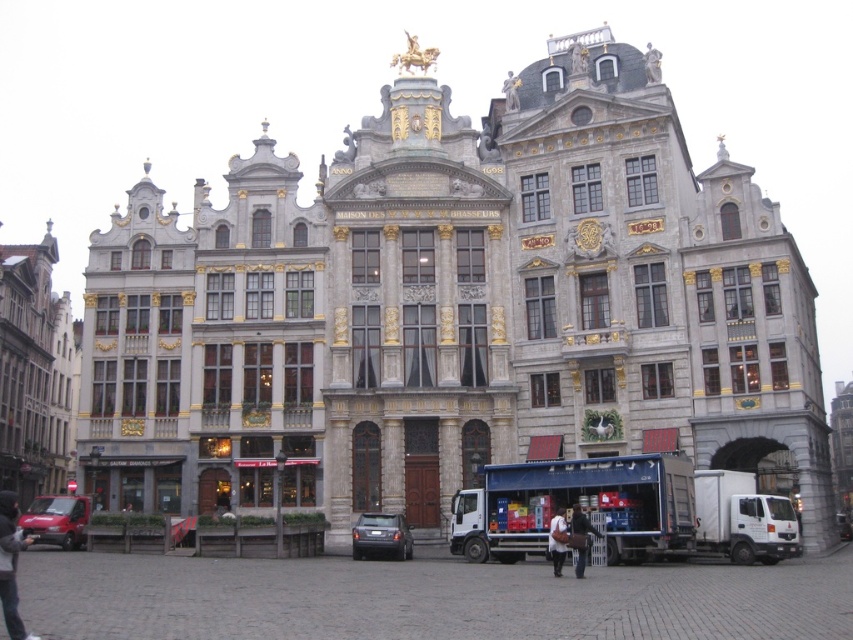
Question: Where is matte red van at lower left located in relation to dark gray shirt at center in the image?

Choices:
 (A) above
 (B) below

Answer: (B)

Question: Is dark brown leather jacket at lower center above dark gray shirt at center?

Choices:
 (A) no
 (B) yes

Answer: (B)

Question: Which object appears farthest from the camera in this image?

Choices:
 (A) dark brown leather jacket at lower center
 (B) matte red van at lower left
 (C) dark gray shirt at center
 (D) dark gray metallic car at center

Answer: (D)

Question: Considering the relative positions of matte red van at lower left and dark brown leather jacket at lower center in the image provided, where is matte red van at lower left located with respect to dark brown leather jacket at lower center?

Choices:
 (A) above
 (B) below

Answer: (B)

Question: Which object appears farthest from the camera in this image?

Choices:
 (A) matte red van at lower left
 (B) dark gray metallic car at center
 (C) dark brown leather jacket at lower center

Answer: (B)

Question: Which of the following is the closest to the observer?

Choices:
 (A) (3, 593)
 (B) (589, 524)

Answer: (A)